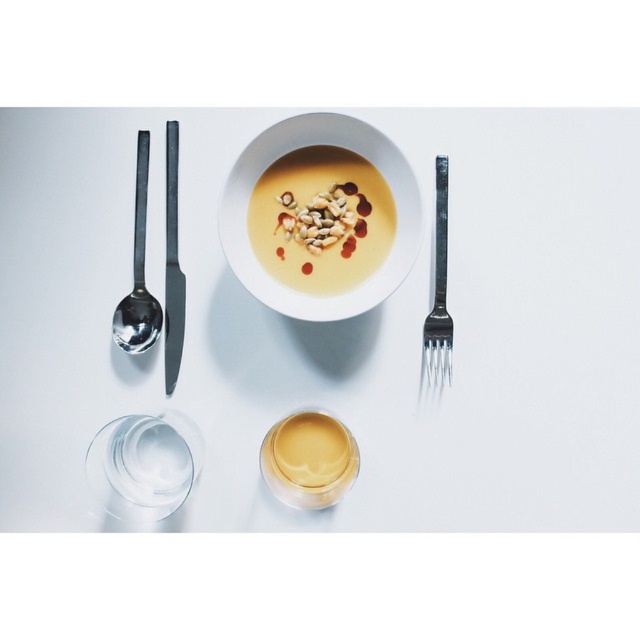
Find the location of `yellow matte soup at center`. yellow matte soup at center is located at coordinates (321, 220).

Does yellow matte soup at center have a smaller size compared to smooth creamy soup with nuts at center?

No, yellow matte soup at center is not smaller than smooth creamy soup with nuts at center.

What do you see at coordinates (321, 220) in the screenshot?
I see `yellow matte soup at center` at bounding box center [321, 220].

Identify the location of yellow matte soup at center. (321, 220).

Describe the element at coordinates (436, 296) in the screenshot. I see `silver metallic fork at right` at that location.

Does silver metallic fork at right appear on the left side of black matte knife at left?

In fact, silver metallic fork at right is to the right of black matte knife at left.

Image resolution: width=640 pixels, height=640 pixels. What are the coordinates of `silver metallic fork at right` in the screenshot? It's located at (436, 296).

Is white glossy bowl at center wider than silver metallic fork at right?

Indeed, white glossy bowl at center has a greater width compared to silver metallic fork at right.

Does white glossy bowl at center have a smaller size compared to silver metallic fork at right?

Actually, white glossy bowl at center might be larger than silver metallic fork at right.

Who is more forward, (436, 484) or (444, 216)?

Point (444, 216)

You are a GUI agent. You are given a task and a screenshot of the screen. Output one action in this format:
    pyautogui.click(x=<x>, y=<y>)
    Task: Click on the white glossy bowl at center
    
    Given the screenshot: What is the action you would take?
    pyautogui.click(x=336, y=324)